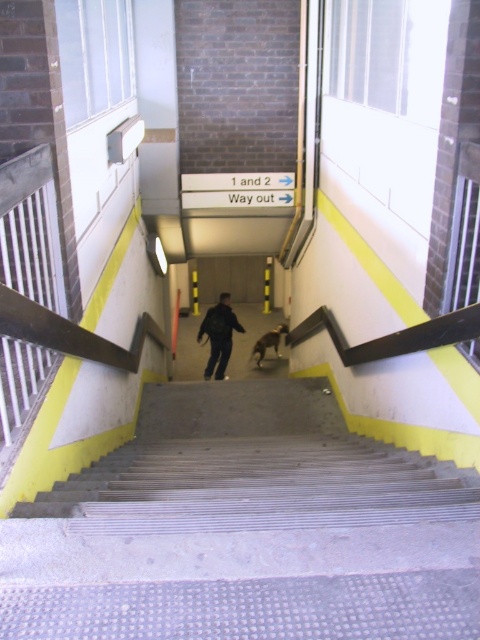
Question: Does black matte jacket at center have a smaller size compared to brown fur dog at center?

Choices:
 (A) no
 (B) yes

Answer: (A)

Question: Which point is farther to the camera?

Choices:
 (A) (256, 365)
 (B) (224, 349)
 (C) (344, 486)

Answer: (A)

Question: Estimate the real-world distances between objects in this image. Which object is closer to the black matte jacket at center?

Choices:
 (A) metallic gray stairs at center
 (B) brown fur dog at center

Answer: (B)

Question: Estimate the real-world distances between objects in this image. Which object is closer to the black matte jacket at center?

Choices:
 (A) metallic gray stairs at center
 (B) brown fur dog at center

Answer: (B)

Question: From the image, what is the correct spatial relationship of black matte jacket at center in relation to brown fur dog at center?

Choices:
 (A) below
 (B) above

Answer: (B)

Question: Can you confirm if metallic gray stairs at center is positioned below brown fur dog at center?

Choices:
 (A) no
 (B) yes

Answer: (B)